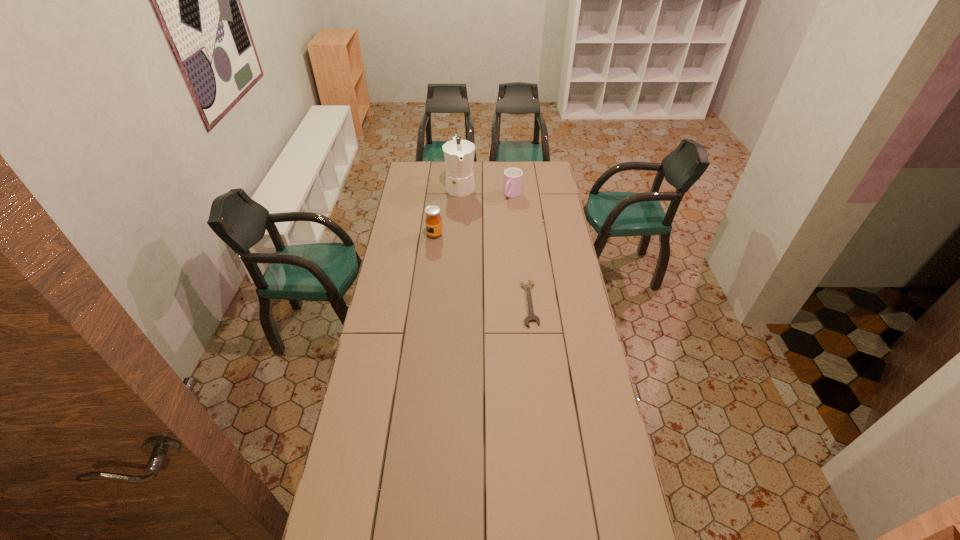
I want to click on blank region between the coffeepot and the cup, so click(x=487, y=191).

Where is `blank region between the cup and the third farthest object`? The height and width of the screenshot is (540, 960). blank region between the cup and the third farthest object is located at coordinates (473, 215).

Where is `vacant region between the honey and the tallest object`? The height and width of the screenshot is (540, 960). vacant region between the honey and the tallest object is located at coordinates (447, 210).

Locate an element on the screen. The width and height of the screenshot is (960, 540). unoccupied position between the cup and the shortest object is located at coordinates (521, 249).

The width and height of the screenshot is (960, 540). I want to click on vacant area that lies between the honey and the shortest object, so (482, 269).

Identify the location of vacant region between the cup and the tallest object. The height and width of the screenshot is (540, 960). (487, 191).

Point out which object is positioned as the second nearest to the tallest object. Please provide its 2D coordinates. Your answer should be formatted as a tuple, i.e. [(x, y)], where the tuple contains the x and y coordinates of a point satisfying the conditions above.

[(433, 221)]

Locate an element on the screen. Image resolution: width=960 pixels, height=540 pixels. object that is the nearest to the wrench is located at coordinates (433, 221).

Where is `vacant point that satisfies the following two spatial constraints: 1. on the front side of the shortest object; 2. on the left side of the cup`? The height and width of the screenshot is (540, 960). vacant point that satisfies the following two spatial constraints: 1. on the front side of the shortest object; 2. on the left side of the cup is located at coordinates pyautogui.click(x=522, y=303).